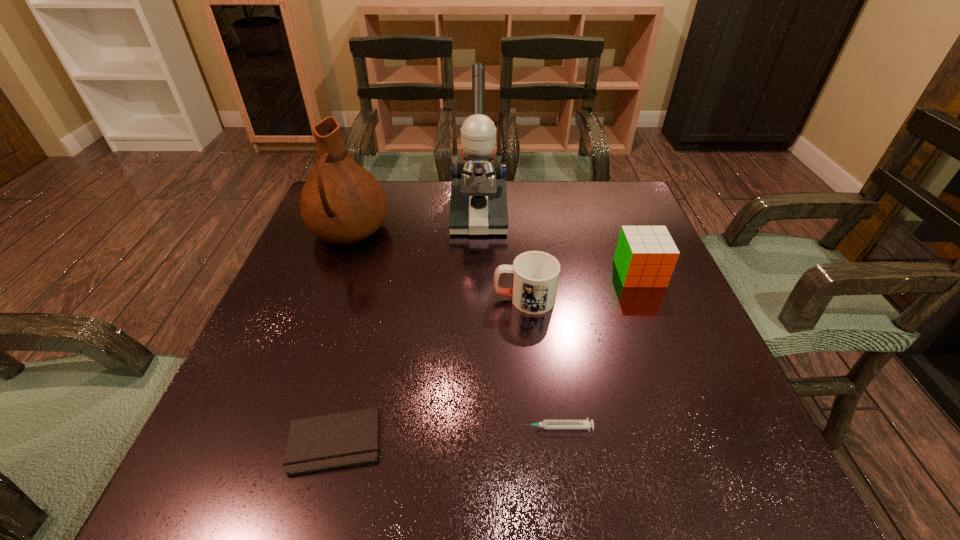
Where is `object that stands as the closest to the cube`? The width and height of the screenshot is (960, 540). object that stands as the closest to the cube is located at coordinates (535, 278).

Where is `vacant region that satisfies the following two spatial constraints: 1. on the side of the pitcher with the handle; 2. on the right side of the shortest object`? The image size is (960, 540). vacant region that satisfies the following two spatial constraints: 1. on the side of the pitcher with the handle; 2. on the right side of the shortest object is located at coordinates (271, 441).

Find the location of a particular element. This screenshot has width=960, height=540. vacant position in the image that satisfies the following two spatial constraints: 1. at the needle end of the syringe; 2. on the front side of the checkbook is located at coordinates (557, 441).